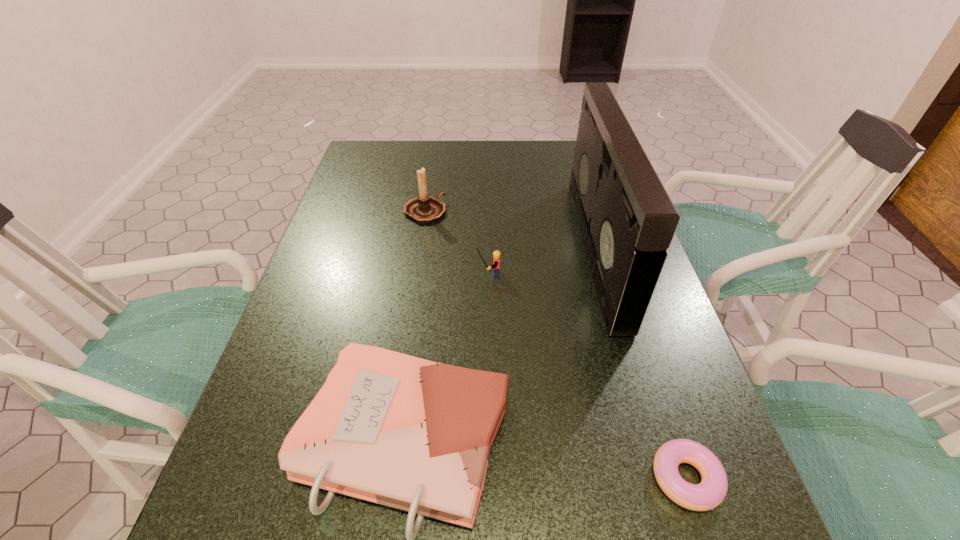
Image resolution: width=960 pixels, height=540 pixels. What are the coordinates of `free space located on the front-facing side of the third shortest object` in the screenshot? It's located at (364, 274).

Find the location of a particular element. Image resolution: width=960 pixels, height=540 pixels. vacant space located 0.110m on the back of the shortest object is located at coordinates (657, 388).

Locate an element on the screen. videotape at the right edge is located at coordinates (627, 220).

The image size is (960, 540). I want to click on doughnut that is at the right edge, so click(711, 491).

Where is `vacant space at the far edge`? vacant space at the far edge is located at coordinates (511, 150).

You are a GUI agent. You are given a task and a screenshot of the screen. Output one action in this format:
    pyautogui.click(x=<x>, y=<y>)
    Task: Click on the vacant space at the left edge
    The width and height of the screenshot is (960, 540).
    Given the screenshot: What is the action you would take?
    pyautogui.click(x=320, y=501)

The image size is (960, 540). In the image, there is a desktop. In order to click on free space at the right edge in this screenshot , I will do `click(689, 418)`.

Find the location of a particular element. Image resolution: width=960 pixels, height=540 pixels. vacant space at the far left corner of the desktop is located at coordinates (392, 159).

Find the location of a particular element. Image resolution: width=960 pixels, height=540 pixels. free space between the videotape and the third shortest object is located at coordinates (542, 261).

Locate an element on the screen. The width and height of the screenshot is (960, 540). free space between the Lego and the videotape is located at coordinates (542, 261).